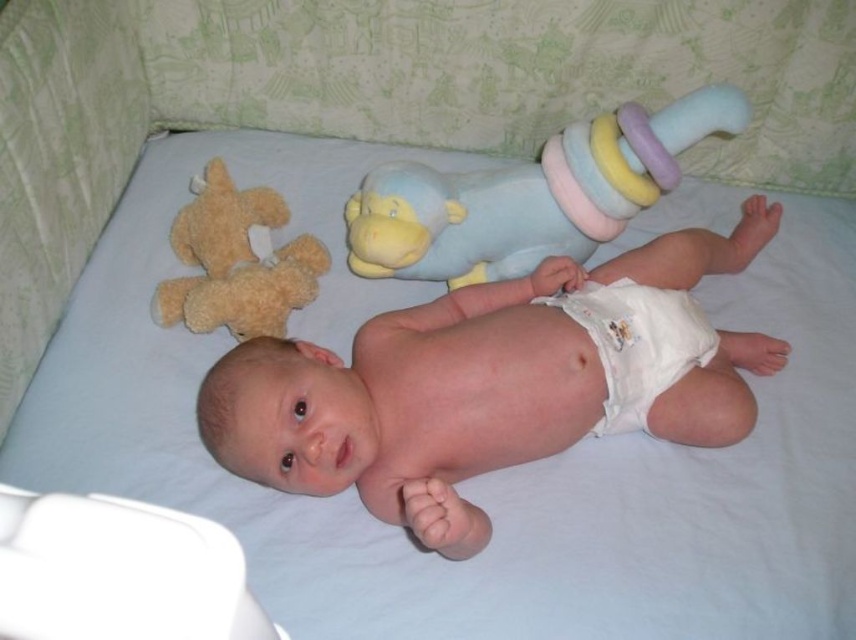
You are a photographer taking a closeup shot of the pink cloth diaper at center. You need to ensure that the diaper is in focus. What is the minimum distance you should set your camera lens to focus on?

The minimum focusing distance should be set to at least 33.11 inches to ensure the pink cloth diaper at center is in focus since it is 33.11 inches away from the camera.

Looking at this image, you are a photographer taking a picture of the baby in the crib. You notice two points in the image labeled as point 1 at coordinates point (550, 426) and point 2 at coordinates point (593, 342). Which point is closer to the camera?

Point (550, 426) is closer to the camera than point (593, 342).

You are a parent checking on your baby in the crib. You see the pink cloth diaper at center and the white cloth diaper at center. Which diaper is closer to the baby?

The pink cloth diaper at center is closer to the baby because it is in front of the white cloth diaper at center.